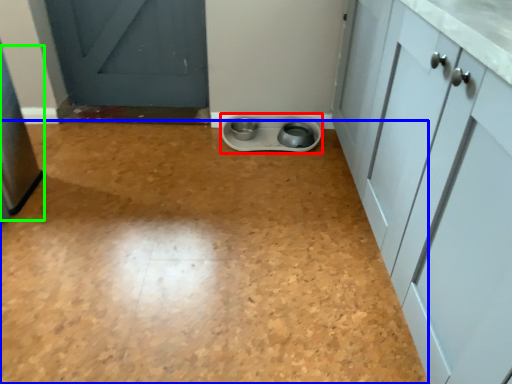
Question: Considering the real-world distances, which object is closest to appliance (highlighted by a red box)? plain (highlighted by a blue box) or appliance (highlighted by a green box).

Choices:
 (A) plain
 (B) appliance

Answer: (A)